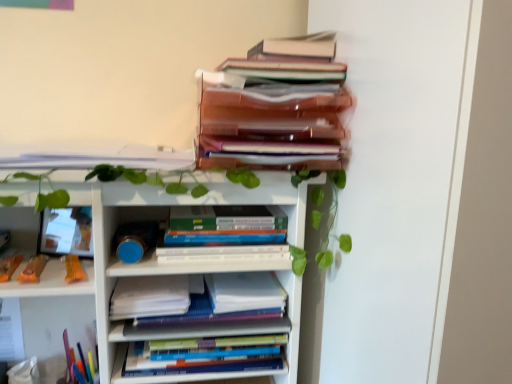
Question: From a real-world perspective, is hardcover books at center, positioned as the 3th book in bottom-to-top order, above or below white paper at center, the first paperback book viewed from the left?

Choices:
 (A) above
 (B) below

Answer: (A)

Question: Considering their positions, is hardcover books at center, the 3th book in the top-to-bottom sequence, located in front of or behind white paper at center, the first paperback book viewed from the left?

Choices:
 (A) behind
 (B) front

Answer: (A)

Question: Which object is the farthest from the white paper at center, arranged as the second book when ordered from the bottom?

Choices:
 (A) white paper at center, which appears as the 1th paperback book when viewed from the right
 (B) white paper at center, the second paperback book in the right-to-left sequence
 (C) white matte bookcase at upper center
 (D) translucent plastic folders at upper center, marked as the 5th book in a bottom-to-top arrangement
 (E) hardcover books at center, which appears as the first book when ordered from the bottom

Answer: (D)

Question: Which is nearer to the white paper at center, which ranks as the second paperback book in left-to-right order?

Choices:
 (A) white paper at center, the second paperback book in the right-to-left sequence
 (B) hardcover books at center, the 3th book in the top-to-bottom sequence
 (C) white paper at upper left, arranged as the fourth book when ordered from the bottom
 (D) translucent plastic folders at upper center, which is counted as the first book, starting from the top
 (E) hardcover books at center, which appears as the first book when ordered from the bottom

Answer: (B)